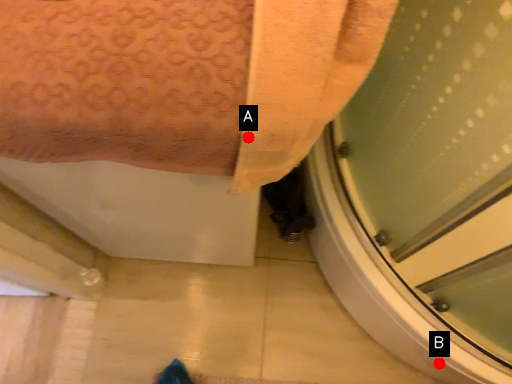
Question: Two points are circled on the image, labeled by A and B beside each circle. Among these points, which one is nearest to the camera?

Choices:
 (A) A is closer
 (B) B is closer

Answer: (A)